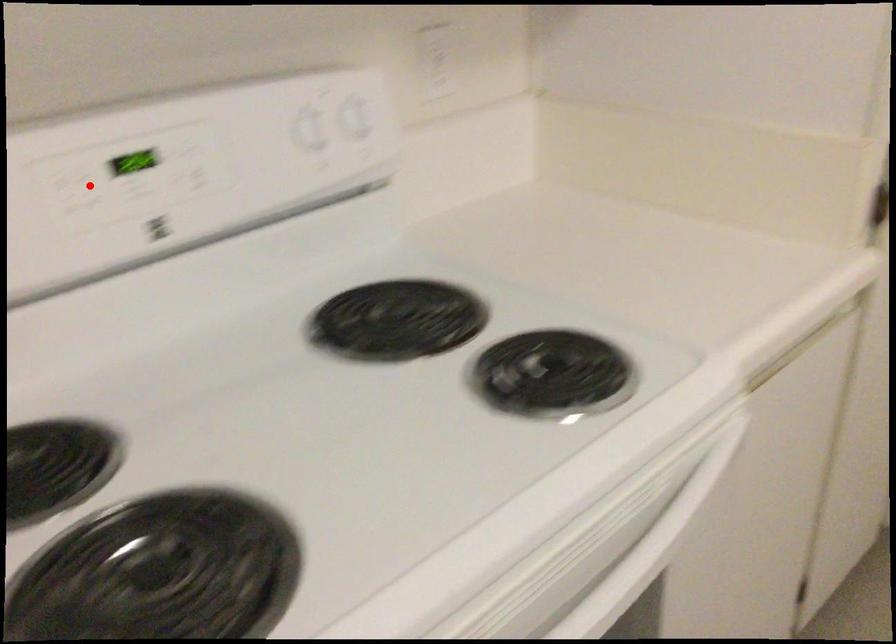
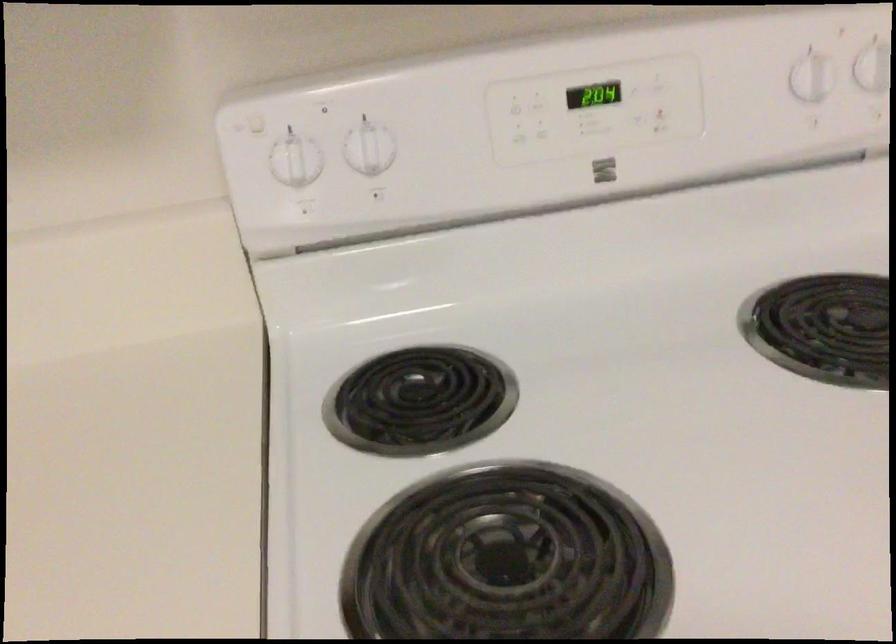
Find the pixel in the second image that matches the highlighted location in the first image.

(538, 106)